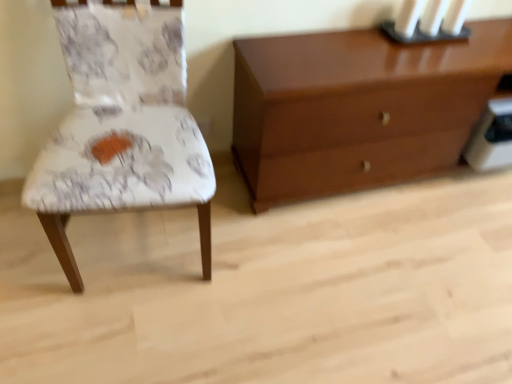
The image size is (512, 384). In order to click on vacant point above black matte candle holder at upper right (from a real-world perspective) in this screenshot , I will do `click(421, 28)`.